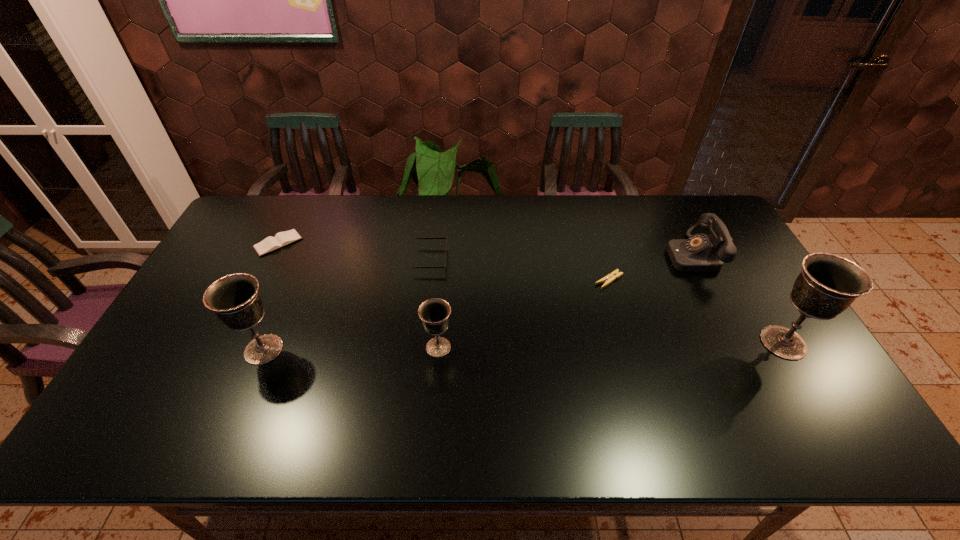
If equal spacing is the goal by inserting an additional chalice among them, please point out a vacant space for this new chalice. Please provide its 2D coordinates. Your answer should be formatted as a tuple, i.e. [(x, y)], where the tuple contains the x and y coordinates of a point satisfying the conditions above.

[(612, 345)]